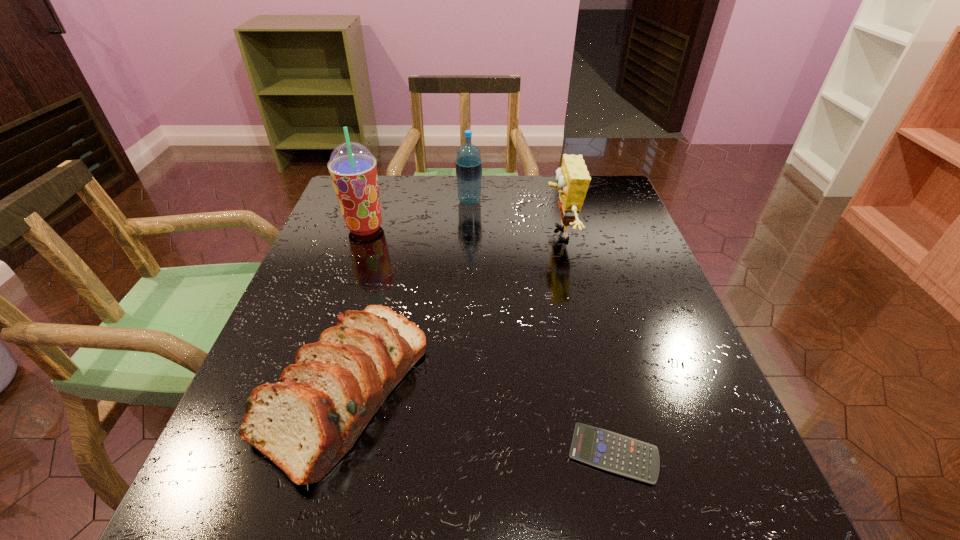
Where is `calculator present at the right edge`? calculator present at the right edge is located at coordinates (606, 450).

In order to click on object that is at the far left corner in this screenshot , I will do `click(353, 169)`.

Locate an element on the screen. The height and width of the screenshot is (540, 960). object at the near left corner is located at coordinates (305, 423).

Image resolution: width=960 pixels, height=540 pixels. I want to click on object that is at the far right corner, so click(573, 179).

At what (x,y) coordinates should I click in order to perform the action: click on object that is at the near right corner. Please return your answer as a coordinate pair (x, y). Looking at the image, I should click on (606, 450).

At what (x,y) coordinates should I click in order to perform the action: click on vacant area at the far edge of the desktop. Please return your answer as a coordinate pair (x, y). The image size is (960, 540). Looking at the image, I should click on (400, 201).

What are the coordinates of `vacant space at the near edge` in the screenshot? It's located at (595, 512).

Locate an element on the screen. Image resolution: width=960 pixels, height=540 pixels. vacant space at the left edge of the desktop is located at coordinates (322, 325).

I want to click on vacant area at the right edge, so click(621, 303).

Find the location of a particular element. Image resolution: width=960 pixels, height=540 pixels. vacant area at the near right corner is located at coordinates (665, 522).